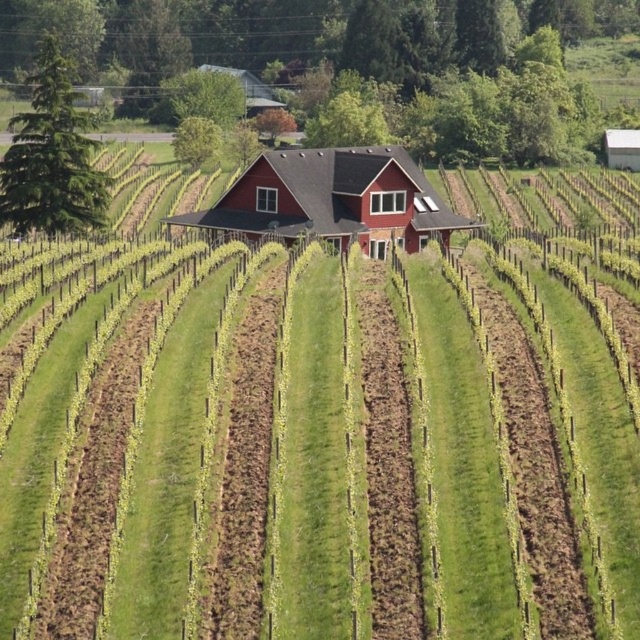
Which is above, matte red barn at center or white corrugated metal barn at upper right?

white corrugated metal barn at upper right is above.

Does matte red barn at center have a greater height compared to white corrugated metal barn at upper right?

Yes, matte red barn at center is taller than white corrugated metal barn at upper right.

This screenshot has height=640, width=640. Describe the element at coordinates (333, 198) in the screenshot. I see `matte red barn at center` at that location.

The height and width of the screenshot is (640, 640). I want to click on matte red barn at center, so (333, 198).